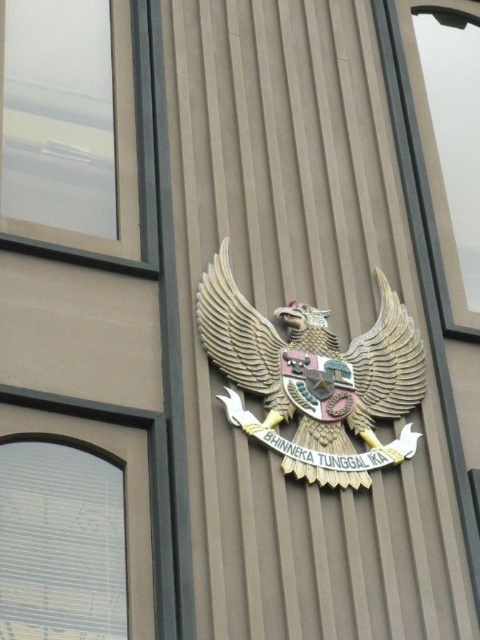
Does wooden eagle at center have a lesser height compared to transparent glass window at upper right?

Correct, wooden eagle at center is not as tall as transparent glass window at upper right.

Does point (204, 304) lie behind point (400, 124)?

That is False.

Is point (383, 308) behind point (403, 60)?

No, (383, 308) is closer to viewer.

This screenshot has height=640, width=480. In order to click on wooden eagle at center in this screenshot , I will do `click(314, 378)`.

Looking at this image, is wooden eagle at center further to the viewer compared to clear glass window at upper left?

No, it is in front of clear glass window at upper left.

Does wooden eagle at center appear under clear glass window at upper left?

Yes, wooden eagle at center is below clear glass window at upper left.

Who is more distant from viewer, (356, 412) or (144, 166)?

The point (144, 166) is more distant.

Locate an element on the screen. This screenshot has height=640, width=480. wooden eagle at center is located at coordinates (314, 378).

Is transparent glass window at upper right wider than clear glass window at upper left?

No, transparent glass window at upper right is not wider than clear glass window at upper left.

Measure the distance between transparent glass window at upper right and clear glass window at upper left.

transparent glass window at upper right is 36.04 feet away from clear glass window at upper left.

Image resolution: width=480 pixels, height=640 pixels. What do you see at coordinates (415, 176) in the screenshot?
I see `transparent glass window at upper right` at bounding box center [415, 176].

The width and height of the screenshot is (480, 640). Identify the location of transparent glass window at upper right. (415, 176).